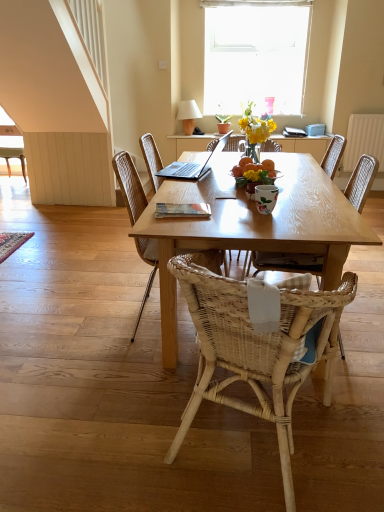
Locate an element on the screen. The width and height of the screenshot is (384, 512). space that is in front of wooden book at center is located at coordinates (189, 222).